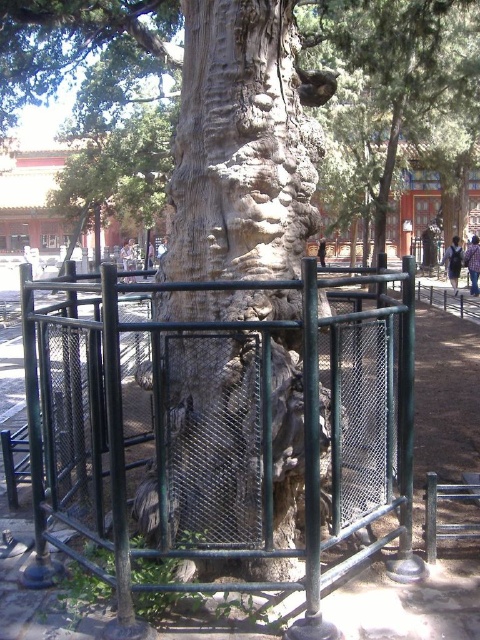
Question: Is green metal fence at center below smooth bark tree at upper center?

Choices:
 (A) yes
 (B) no

Answer: (A)

Question: Is rough bark tree at center positioned in front of smooth bark tree at upper center?

Choices:
 (A) no
 (B) yes

Answer: (B)

Question: Can you confirm if green metal fence at center is wider than rough bark tree at center?

Choices:
 (A) yes
 (B) no

Answer: (B)

Question: Considering the real-world distances, which object is farthest from the rough bark tree trunk at center?

Choices:
 (A) rough bark tree at center
 (B) smooth bark tree at upper center

Answer: (B)

Question: Which object is positioned closest to the smooth bark tree at upper center?

Choices:
 (A) rough bark tree at center
 (B) green metal fence at center

Answer: (A)

Question: Which point is closer to the camera?

Choices:
 (A) smooth bark tree at upper center
 (B) rough bark tree trunk at center
 (C) green metal fence at center

Answer: (C)